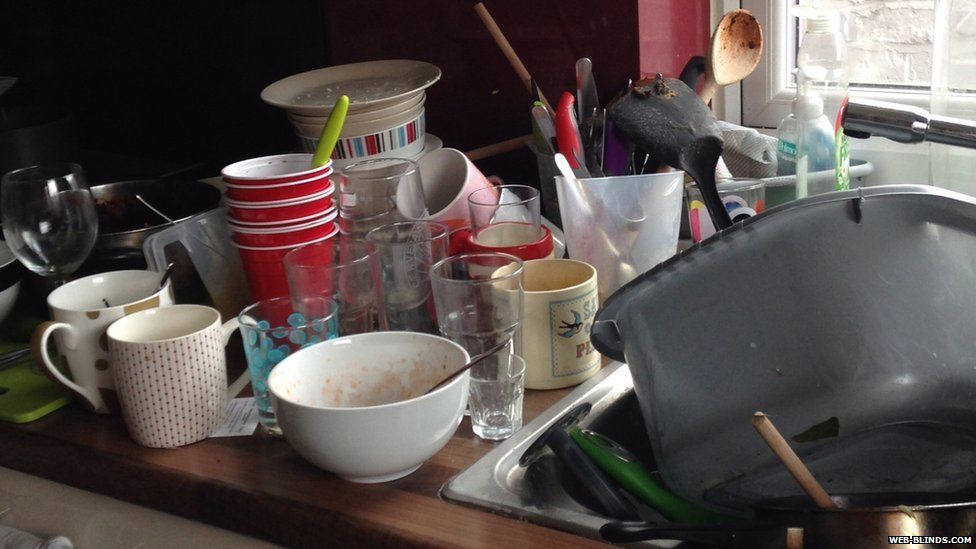
Locate an element on the screen. The width and height of the screenshot is (976, 549). kitchen sink is located at coordinates (482, 491).